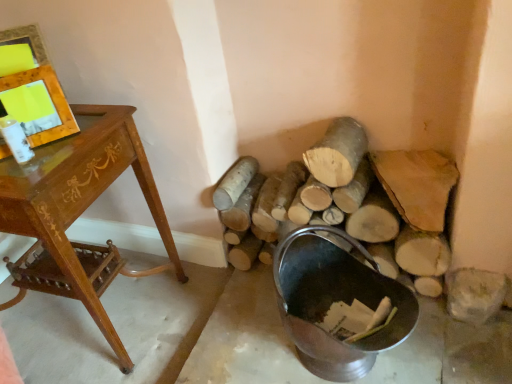
This screenshot has height=384, width=512. What are the coordinates of `vacant space situated on the left part of metallic bucket at lower right` in the screenshot? It's located at (243, 342).